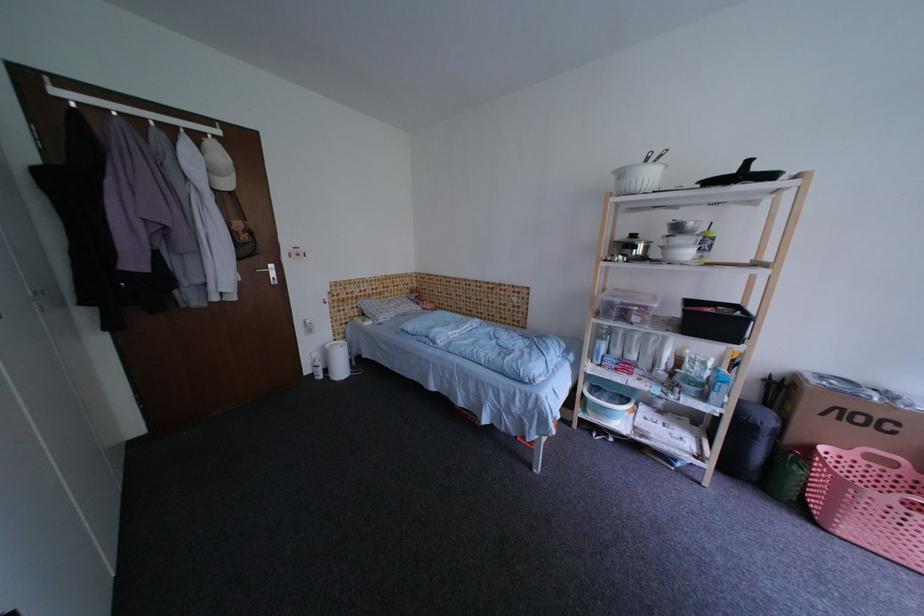
What do you see at coordinates (677, 253) in the screenshot? I see `the white ceramic bowl` at bounding box center [677, 253].